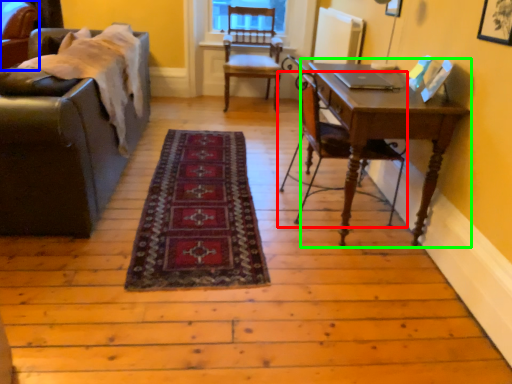
Question: Estimate the real-world distances between objects in this image. Which object is closer to chair (highlighted by a red box), chair (highlighted by a blue box) or table (highlighted by a green box)?

Choices:
 (A) chair
 (B) table

Answer: (B)